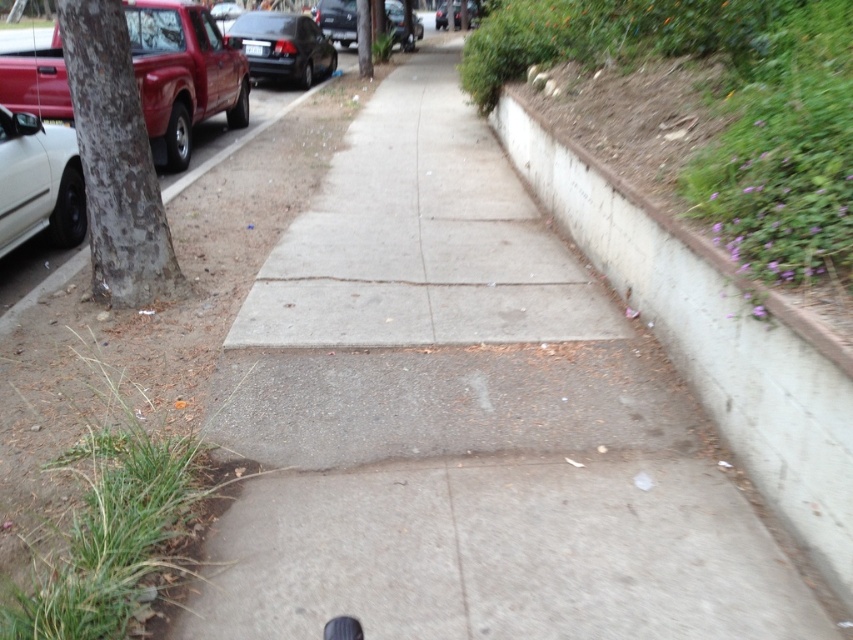
You are a delivery person carrying a package and need to cross the sidewalk from the matte red truck at left to the concrete at right. The sidewalk is 15 feet wide. Can you safely make this crossing without stepping off the sidewalk?

The concrete at right is 16.05 feet from the matte red truck at left. Since the sidewalk is only 15 feet wide, the distance between them exceeds the sidewalk width, so you cannot safely cross without stepping off the sidewalk.

You are standing on the sidewalk in the residential area shown in the image. You see a shiny black car at upper left. Where is the point located at coordinates (283, 45) in relation to the shiny black car at upper left?

The point located at coordinates (283, 45) corresponds to the shiny black car at upper left.

You are a pedestrian standing on the sidewalk and see the white matte car at left and the black rubber shoe at lower center. Which object is higher from the ground?

The white matte car at left is higher from the ground than the black rubber shoe at lower center because it is positioned above it.